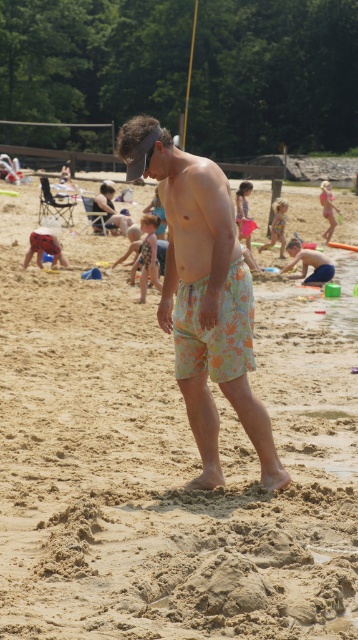
Between beige sandy beach at center and floral swim trunks at center, which one has more height?

beige sandy beach at center is taller.

Looking at this image, is beige sandy beach at center to the left of floral swim trunks at center from the viewer's perspective?

Correct, you'll find beige sandy beach at center to the left of floral swim trunks at center.

Who is more forward, (41,541) or (254,448)?

Point (41,541) is in front.

The width and height of the screenshot is (358, 640). In order to click on beige sandy beach at center in this screenshot , I will do `click(163, 467)`.